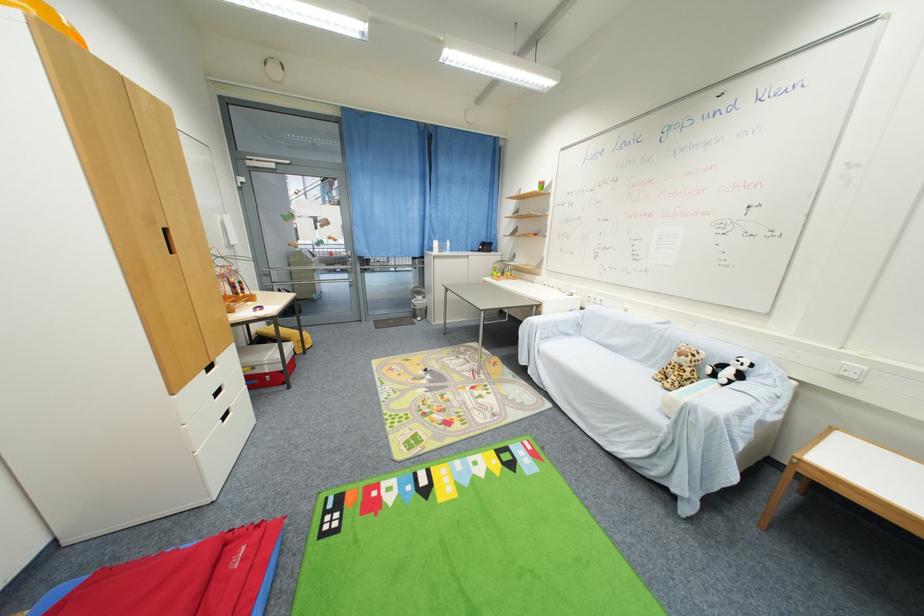
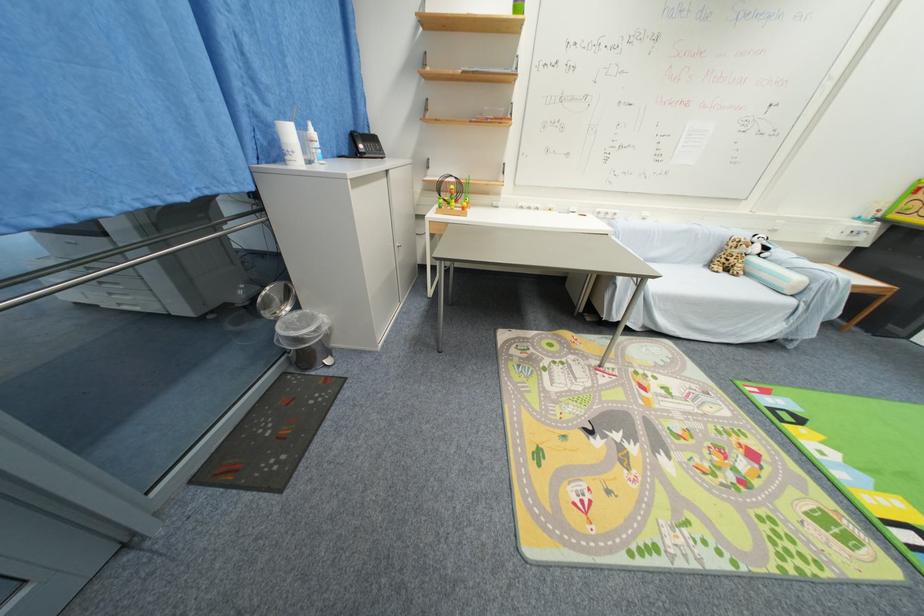
Locate, in the second image, the point that corresponds to pixel 491 249 in the first image.

(377, 148)